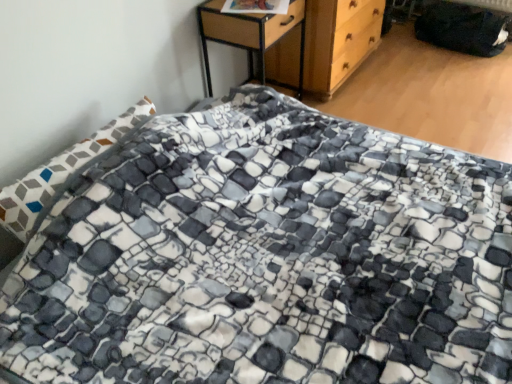
Question: From a real-world perspective, is woodenmaterial/texturenightstand at upper center physically below wooden chest of drawers at upper center?

Choices:
 (A) yes
 (B) no

Answer: (B)

Question: Is wooden chest of drawers at upper center at the back of woodenmaterial/texturenightstand at upper center?

Choices:
 (A) no
 (B) yes

Answer: (A)

Question: Is woodenmaterial/texturenightstand at upper center not close to wooden chest of drawers at upper center?

Choices:
 (A) yes
 (B) no

Answer: (B)

Question: Is the depth of woodenmaterial/texturenightstand at upper center less than that of wooden chest of drawers at upper center?

Choices:
 (A) no
 (B) yes

Answer: (B)

Question: Is woodenmaterial/texturenightstand at upper center wider than wooden chest of drawers at upper center?

Choices:
 (A) no
 (B) yes

Answer: (A)

Question: Can you confirm if woodenmaterial/texturenightstand at upper center is positioned to the right of wooden chest of drawers at upper center?

Choices:
 (A) no
 (B) yes

Answer: (A)

Question: Could you tell me if wooden chest of drawers at upper center is turned towards woodenmaterial/texturenightstand at upper center?

Choices:
 (A) no
 (B) yes

Answer: (A)

Question: Does wooden chest of drawers at upper center appear on the right side of woodenmaterial/texturenightstand at upper center?

Choices:
 (A) no
 (B) yes

Answer: (B)

Question: From the image's perspective, is wooden chest of drawers at upper center below woodenmaterial/texturenightstand at upper center?

Choices:
 (A) no
 (B) yes

Answer: (A)

Question: Is the depth of wooden chest of drawers at upper center less than that of woodenmaterial/texturenightstand at upper center?

Choices:
 (A) yes
 (B) no

Answer: (B)

Question: Is wooden chest of drawers at upper center turned away from woodenmaterial/texturenightstand at upper center?

Choices:
 (A) yes
 (B) no

Answer: (B)

Question: Does wooden chest of drawers at upper center lie behind woodenmaterial/texturenightstand at upper center?

Choices:
 (A) yes
 (B) no

Answer: (A)

Question: Based on their sizes in the image, would you say wooden chest of drawers at upper center is bigger or smaller than woodenmaterial/texturenightstand at upper center?

Choices:
 (A) small
 (B) big

Answer: (B)